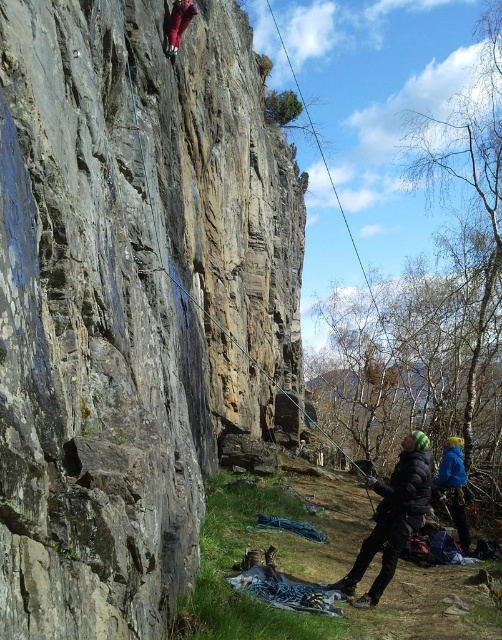
You are a photographer planning to take a photo of the black puffy jacket at lower center and the shiny red leggings at upper left. Which object should you focus on first if you want to capture both in the same frame without adjusting your camera angle?

You should focus on the black puffy jacket at lower center first because it is taller than the shiny red leggings at upper left, ensuring it is in focus while the leggings remain within the depth of field.

You are a climber preparing to ascend the cliff. You need to place your first anchor at the rough gray rock at center. According to the coordinates provided, where exactly should you aim your anchor placement?

The rough gray rock at center is located at coordinates point (130,301), so you should aim your anchor placement there.